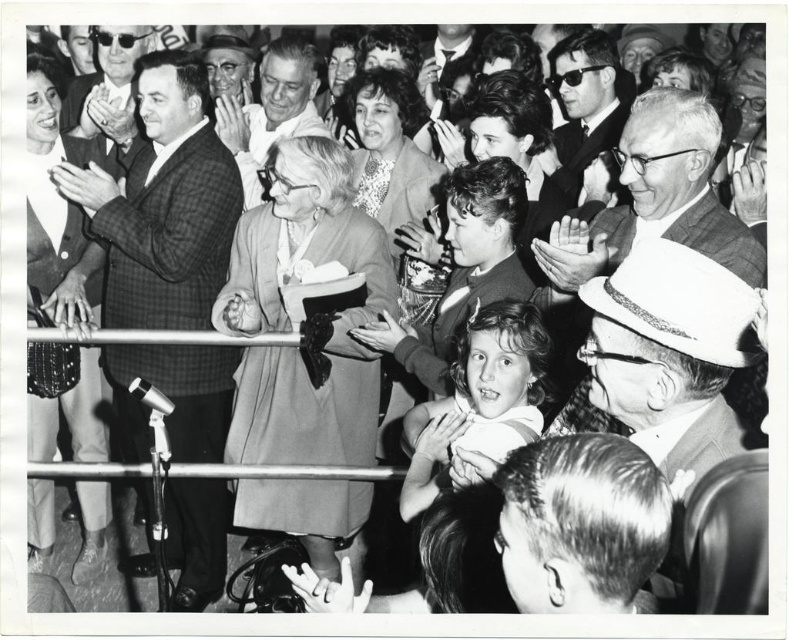
You are a photographer at the event and want to capture a photo of both the sequined fabric dress at left and the shiny black sunglasses at upper center. Which object should you focus on first to ensure both are in sharp focus?

The sequined fabric dress at left is closer to the viewer than the shiny black sunglasses at upper center. To ensure both are in sharp focus, you should focus on the sequined fabric dress at left first, as it is closer, and the depth of field will naturally include the sunglasses in the background.

Based on the coordinates provided, which object in the scene corresponds to the point labeled as point [55,209]?

The point labeled as point [55,209] corresponds to the sequined fabric dress at left.